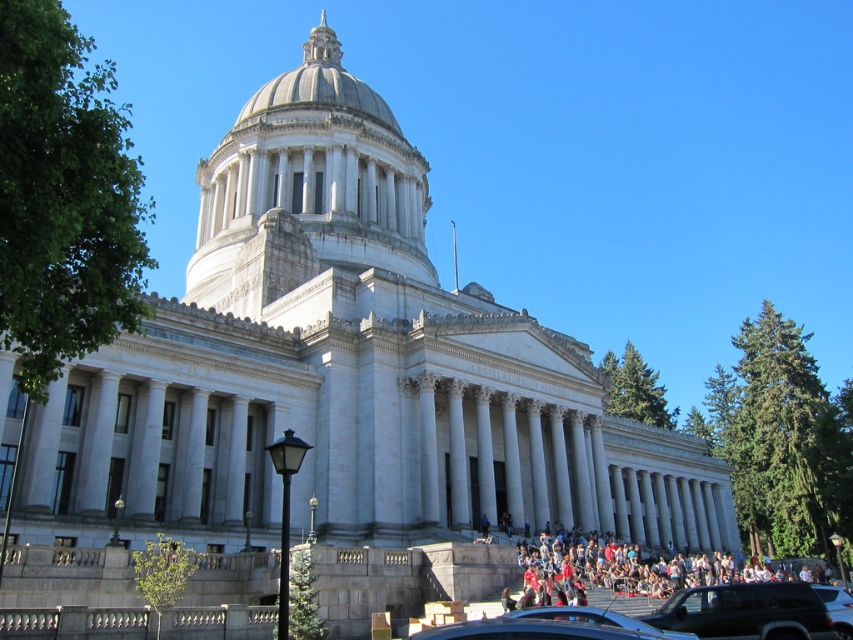
Which is behind, point (570, 632) or point (151, 556)?

The point (151, 556) is more distant.

Can you confirm if metallic silver car at lower center is taller than green leafy tree at lower left?

Indeed, metallic silver car at lower center has a greater height compared to green leafy tree at lower left.

At what (x,y) coordinates should I click in order to perform the action: click on metallic silver car at lower center. Please return your answer as a coordinate pair (x, y). The height and width of the screenshot is (640, 853). Looking at the image, I should click on (552, 627).

Image resolution: width=853 pixels, height=640 pixels. I want to click on metallic silver car at lower center, so click(x=552, y=627).

Can you confirm if green leafy tree at lower left is positioned to the right of green textured tree at lower center?

In fact, green leafy tree at lower left is to the left of green textured tree at lower center.

Which is more to the right, green leafy tree at lower left or green textured tree at lower center?

From the viewer's perspective, green textured tree at lower center appears more on the right side.

Where is `green leafy tree at lower left`? green leafy tree at lower left is located at coordinates (161, 573).

Locate an element on the screen. The height and width of the screenshot is (640, 853). green leafy tree at lower left is located at coordinates (161, 573).

Can you confirm if green leafy tree at left is bigger than matte black suv at lower right?

Indeed, green leafy tree at left has a larger size compared to matte black suv at lower right.

Which is above, green leafy tree at left or matte black suv at lower right?

green leafy tree at left

Measure the distance between green leafy tree at left and camera.

green leafy tree at left is 75.61 feet away from camera.

The image size is (853, 640). I want to click on green leafy tree at left, so click(62, 196).